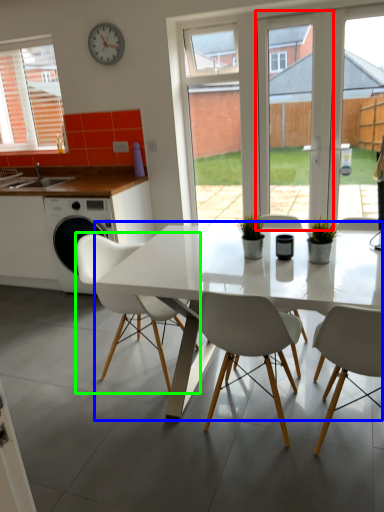
Question: Which object is the farthest from screen door (highlighted by a red box)? Choose among these: kitchen & dining room table (highlighted by a blue box) or chair (highlighted by a green box).

Choices:
 (A) kitchen & dining room table
 (B) chair

Answer: (B)